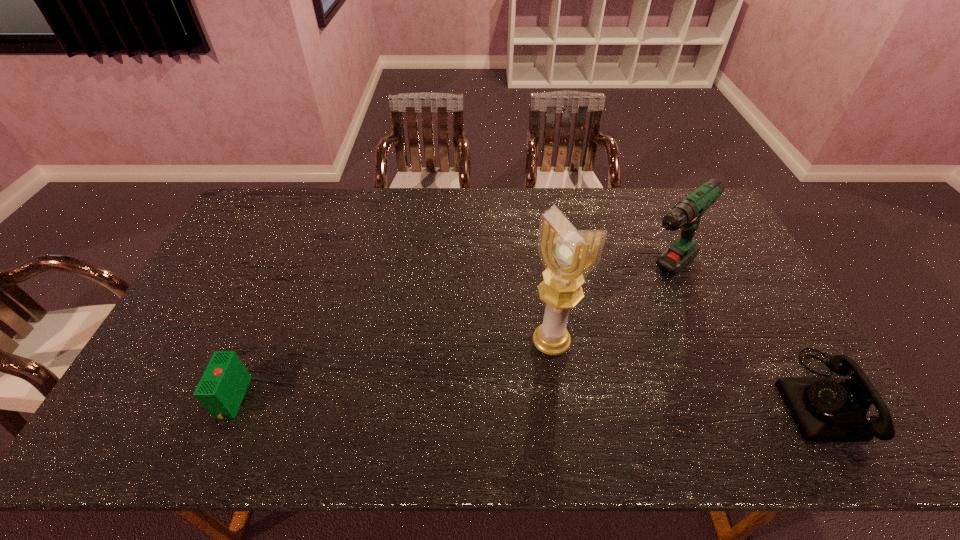
At what (x,y) coordinates should I click in order to perform the action: click on vacant region between the rightmost object and the third object from left to right. Please return your answer as a coordinate pair (x, y). Looking at the image, I should click on (744, 335).

The image size is (960, 540). What are the coordinates of `vacant point located between the rightmost object and the award` in the screenshot? It's located at (688, 370).

I want to click on vacant area that lies between the award and the rightmost object, so click(688, 370).

I want to click on empty space between the rightmost object and the drill, so click(744, 335).

You are a GUI agent. You are given a task and a screenshot of the screen. Output one action in this format:
    pyautogui.click(x=<x>, y=<y>)
    Task: Click on the free space between the alarm clock and the third object from right to left
    Image resolution: width=960 pixels, height=540 pixels.
    Given the screenshot: What is the action you would take?
    pyautogui.click(x=392, y=370)

This screenshot has width=960, height=540. I want to click on vacant area between the second object from right to left and the leftmost object, so click(x=447, y=336).

Where is `free space between the award and the leftmost object`? free space between the award and the leftmost object is located at coordinates 392,370.

Identify the location of free space between the telephone and the second object from left to right. click(688, 370).

Identify which object is located as the third nearest to the award. Please provide its 2D coordinates. Your answer should be formatted as a tuple, i.e. [(x, y)], where the tuple contains the x and y coordinates of a point satisfying the conditions above.

[(221, 389)]

Where is `object that is the second nearest to the leftmost object`? The image size is (960, 540). object that is the second nearest to the leftmost object is located at coordinates (686, 214).